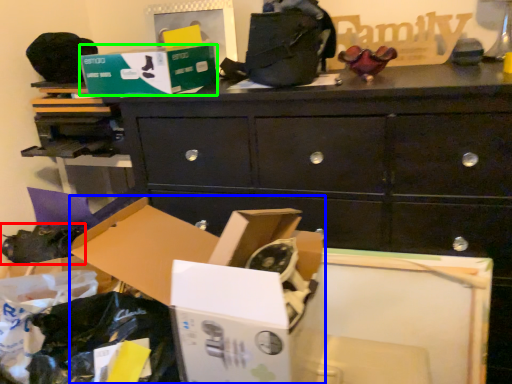
Question: Based on their relative distances, which object is nearer to shoe (highlighted by a red box)? Choose from storage box (highlighted by a blue box) and storage box (highlighted by a green box).

Choices:
 (A) storage box
 (B) storage box

Answer: (B)